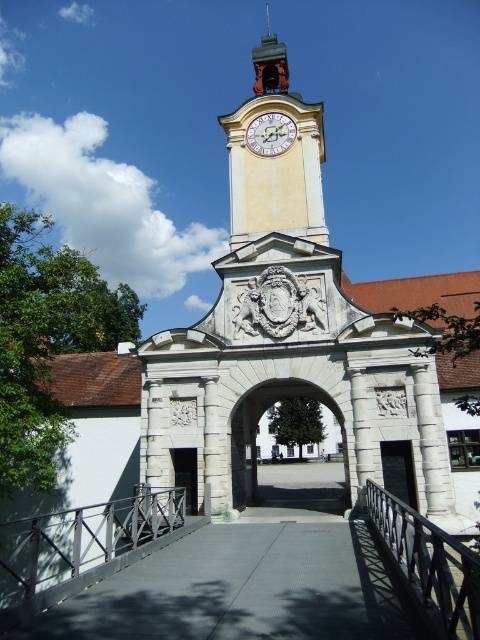
You are a visitor standing in front of the historical gatehouse. You want to ring the polished copper bell at upper center. Which side of the bell should you approach from to reach the black wrought iron railing at lower right?

The black wrought iron railing at lower right is to the right of the polished copper bell at upper center, so you should approach the bell from its right side to reach the railing.

You are a tourist standing at the base of the yellow stone clock tower at upper center and want to take a photo of the black wrought iron railing at lower right. Can you see the railing clearly from your current position?

The black wrought iron railing at lower right is behind the yellow stone clock tower at upper center, so it will be blocked from view. You need to move to a position where the railing is not behind the tower to see it clearly.

In the scene shown: You are standing in front of the grand gatehouse and notice two points marked on the structure. The first point is located at coordinate point (271, 128) and the second at point (285, 67). Which of these two points is positioned closer to your current viewpoint?

Point (271, 128) is closer to the viewer than point (285, 67).